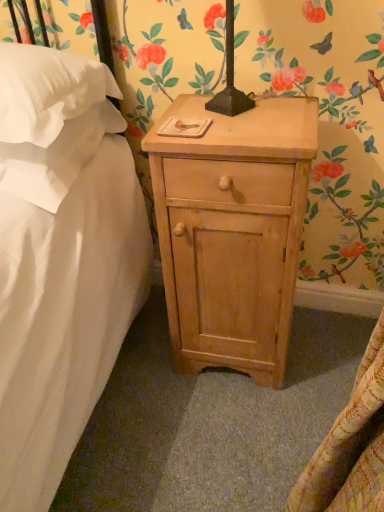
Identify the location of white soft pillow at upper left, arranged as the first pillow when ordered from the bottom. (56, 157).

I want to click on natural wood nightstand at center, so click(233, 231).

This screenshot has width=384, height=512. What do you see at coordinates (233, 231) in the screenshot? I see `natural wood nightstand at center` at bounding box center [233, 231].

Where is `white soft pillow at upper left, the first pillow viewed from the top`? The image size is (384, 512). white soft pillow at upper left, the first pillow viewed from the top is located at coordinates (50, 92).

Is white soft pillow at upper left, which is counted as the second pillow, starting from the bottom, turned away from white soft pillow at upper left, the second pillow when ordered from top to bottom?

No, white soft pillow at upper left, which is counted as the second pillow, starting from the bottom,'s orientation is not away from white soft pillow at upper left, the second pillow when ordered from top to bottom.

Considering their positions, is white soft pillow at upper left, which is counted as the second pillow, starting from the bottom, located in front of or behind white soft pillow at upper left, the second pillow when ordered from top to bottom?

Visually, white soft pillow at upper left, which is counted as the second pillow, starting from the bottom, is located in front of white soft pillow at upper left, the second pillow when ordered from top to bottom.

Does white soft pillow at upper left, which is counted as the second pillow, starting from the bottom, contain white soft pillow at upper left, arranged as the first pillow when ordered from the bottom?

No, white soft pillow at upper left, arranged as the first pillow when ordered from the bottom, is not inside white soft pillow at upper left, which is counted as the second pillow, starting from the bottom.

Is white soft pillow at upper left, arranged as the first pillow when ordered from the bottom, a part of natural wood nightstand at center?

No, white soft pillow at upper left, arranged as the first pillow when ordered from the bottom, is not inside natural wood nightstand at center.

From a real-world perspective, is natural wood nightstand at center on top of white soft pillow at upper left, the second pillow when ordered from top to bottom?

No, from a real-world perspective, natural wood nightstand at center is not above white soft pillow at upper left, the second pillow when ordered from top to bottom.

Is natural wood nightstand at center next to white soft pillow at upper left, the second pillow when ordered from top to bottom?

No, natural wood nightstand at center is not in contact with white soft pillow at upper left, the second pillow when ordered from top to bottom.

Is natural wood nightstand at center wider than white soft pillow at upper left, the second pillow when ordered from top to bottom?

In fact, natural wood nightstand at center might be narrower than white soft pillow at upper left, the second pillow when ordered from top to bottom.

Is white soft pillow at upper left, the second pillow when ordered from top to bottom, positioned behind natural wood nightstand at center?

Yes, it is.

Is white soft pillow at upper left, arranged as the first pillow when ordered from the bottom, to the right of natural wood nightstand at center from the viewer's perspective?

No.

From the picture: Is white soft pillow at upper left, the second pillow when ordered from top to bottom, not close to natural wood nightstand at center?

That's not correct — white soft pillow at upper left, the second pillow when ordered from top to bottom, is a little close to natural wood nightstand at center.

Is point (61, 182) positioned behind point (211, 290)?

No, it is not.

Where is `nightstand on the right side of white soft pillow at upper left, the first pillow viewed from the top`? This screenshot has width=384, height=512. nightstand on the right side of white soft pillow at upper left, the first pillow viewed from the top is located at coordinates (233, 231).

From the image's perspective, which is above, natural wood nightstand at center or white soft pillow at upper left, the first pillow viewed from the top?

From the image's view, white soft pillow at upper left, the first pillow viewed from the top, is above.

Which object is thinner, natural wood nightstand at center or white soft pillow at upper left, the first pillow viewed from the top?

Thinner between the two is natural wood nightstand at center.

Could you tell me if natural wood nightstand at center is turned towards white soft pillow at upper left, which is counted as the second pillow, starting from the bottom?

No, natural wood nightstand at center is not aimed at white soft pillow at upper left, which is counted as the second pillow, starting from the bottom.

From the image's perspective, which object appears higher, white soft pillow at upper left, the second pillow when ordered from top to bottom, or white soft pillow at upper left, the first pillow viewed from the top?

white soft pillow at upper left, the first pillow viewed from the top.

I want to click on pillow on the right of the white soft pillow at upper left, which is counted as the second pillow, starting from the bottom, so click(x=56, y=157).

Is white soft pillow at upper left, the second pillow when ordered from top to bottom, far away from white soft pillow at upper left, which is counted as the second pillow, starting from the bottom?

No, there isn't a large distance between white soft pillow at upper left, the second pillow when ordered from top to bottom, and white soft pillow at upper left, which is counted as the second pillow, starting from the bottom.

Which object is further away from the camera, white soft pillow at upper left, the second pillow when ordered from top to bottom, or white soft pillow at upper left, which is counted as the second pillow, starting from the bottom?

white soft pillow at upper left, the second pillow when ordered from top to bottom, is further away from the camera.

Between point (58, 89) and point (264, 368), which one is positioned behind?

The point (264, 368) is behind.

Considering the sizes of objects white soft pillow at upper left, which is counted as the second pillow, starting from the bottom, and natural wood nightstand at center in the image provided, who is wider, white soft pillow at upper left, which is counted as the second pillow, starting from the bottom, or natural wood nightstand at center?

Wider between the two is white soft pillow at upper left, which is counted as the second pillow, starting from the bottom.

Consider the image. Who is bigger, white soft pillow at upper left, which is counted as the second pillow, starting from the bottom, or natural wood nightstand at center?

With larger size is natural wood nightstand at center.

What's the angular difference between white soft pillow at upper left, the first pillow viewed from the top, and natural wood nightstand at center's facing directions?

There is a 2.19-degree angle between the facing directions of white soft pillow at upper left, the first pillow viewed from the top, and natural wood nightstand at center.

Where is `pillow on the right of white soft pillow at upper left, which is counted as the second pillow, starting from the bottom`? pillow on the right of white soft pillow at upper left, which is counted as the second pillow, starting from the bottom is located at coordinates (56, 157).

This screenshot has width=384, height=512. In order to click on nightstand lying below the white soft pillow at upper left, the second pillow when ordered from top to bottom (from the image's perspective) in this screenshot , I will do `click(233, 231)`.

Which object lies nearer to the anchor point natural wood nightstand at center, white soft pillow at upper left, arranged as the first pillow when ordered from the bottom, or white soft pillow at upper left, which is counted as the second pillow, starting from the bottom?

white soft pillow at upper left, arranged as the first pillow when ordered from the bottom, is positioned closer to the anchor natural wood nightstand at center.

Looking at the image, which one is located further to white soft pillow at upper left, which is counted as the second pillow, starting from the bottom, white soft pillow at upper left, arranged as the first pillow when ordered from the bottom, or natural wood nightstand at center?

Among the two, natural wood nightstand at center is located further to white soft pillow at upper left, which is counted as the second pillow, starting from the bottom.

Estimate the real-world distances between objects in this image. Which object is closer to white soft pillow at upper left, the second pillow when ordered from top to bottom, white soft pillow at upper left, the first pillow viewed from the top, or natural wood nightstand at center?

white soft pillow at upper left, the first pillow viewed from the top, is positioned closer to the anchor white soft pillow at upper left, the second pillow when ordered from top to bottom.

Considering their positions, is natural wood nightstand at center positioned further to white soft pillow at upper left, which is counted as the second pillow, starting from the bottom, than white soft pillow at upper left, the second pillow when ordered from top to bottom?

natural wood nightstand at center is positioned further to the anchor white soft pillow at upper left, which is counted as the second pillow, starting from the bottom.

From the image, which object appears to be farther from white soft pillow at upper left, the second pillow when ordered from top to bottom, natural wood nightstand at center or white soft pillow at upper left, the first pillow viewed from the top?

natural wood nightstand at center lies further to white soft pillow at upper left, the second pillow when ordered from top to bottom, than the other object.

When comparing their distances from natural wood nightstand at center, does white soft pillow at upper left, which is counted as the second pillow, starting from the bottom, or white soft pillow at upper left, arranged as the first pillow when ordered from the bottom, seem further?

The object further to natural wood nightstand at center is white soft pillow at upper left, which is counted as the second pillow, starting from the bottom.

Locate an element on the screen. The width and height of the screenshot is (384, 512). pillow located between white soft pillow at upper left, the first pillow viewed from the top, and natural wood nightstand at center in the left-right direction is located at coordinates (56, 157).